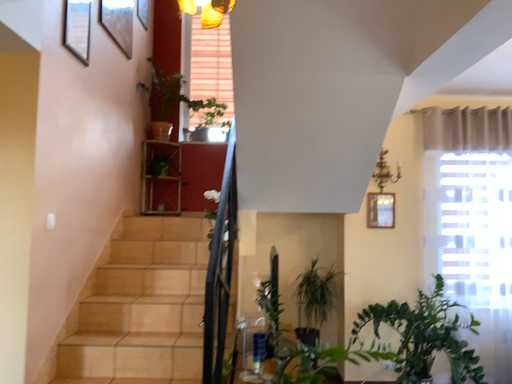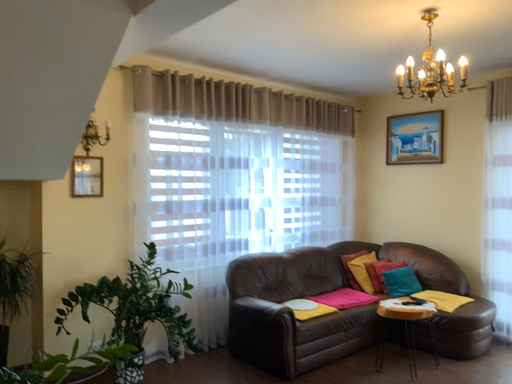
Question: Which way did the camera rotate in the video?

Choices:
 (A) rotated left
 (B) rotated right

Answer: (B)